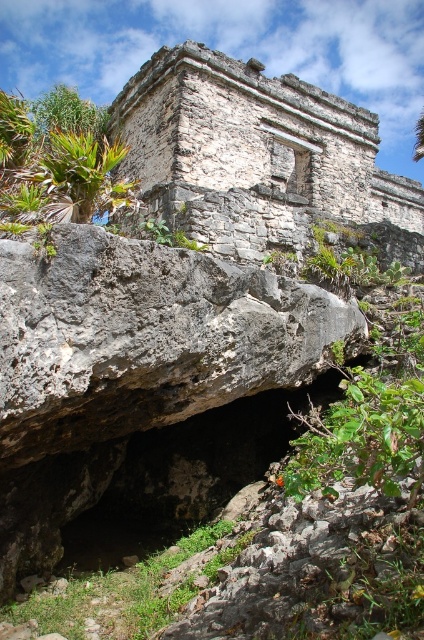
Based on the photo, is weathered stone ruins at upper center thinner than green leafy palm tree at upper left?

No.

Image resolution: width=424 pixels, height=640 pixels. What do you see at coordinates (254, 154) in the screenshot? I see `weathered stone ruins at upper center` at bounding box center [254, 154].

Image resolution: width=424 pixels, height=640 pixels. What are the coordinates of `weathered stone ruins at upper center` in the screenshot? It's located at (254, 154).